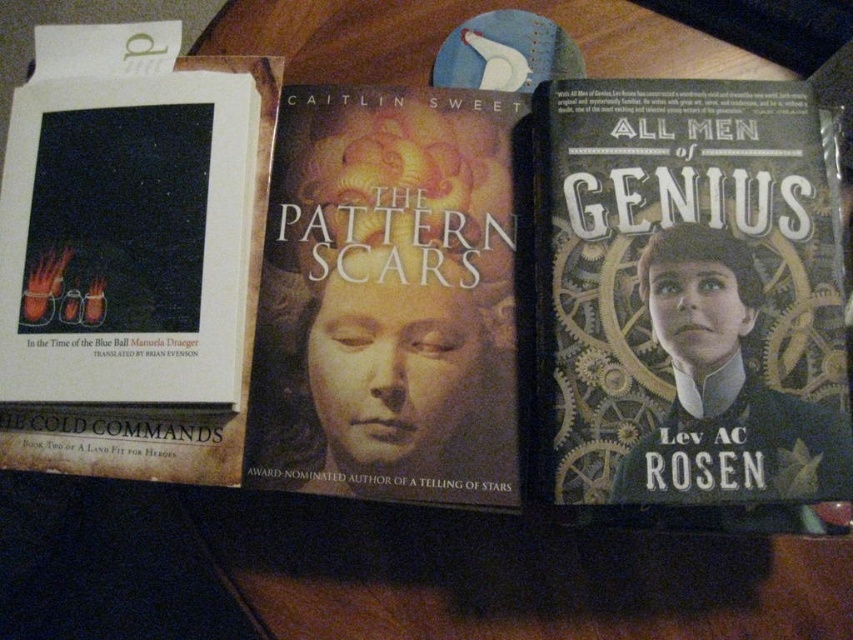
Is steampunk-patterned book cover at right above matte paper book cover at center?

No, steampunk-patterned book cover at right is not above matte paper book cover at center.

Can you confirm if steampunk-patterned book cover at right is positioned below matte paper book cover at center?

Yes, steampunk-patterned book cover at right is below matte paper book cover at center.

The image size is (853, 640). What do you see at coordinates (689, 305) in the screenshot? I see `steampunk-patterned book cover at right` at bounding box center [689, 305].

Image resolution: width=853 pixels, height=640 pixels. I want to click on steampunk-patterned book cover at right, so click(689, 305).